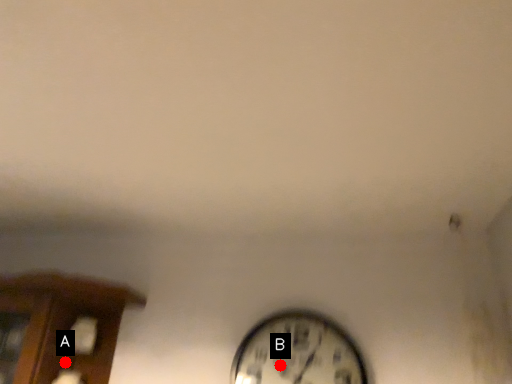
Question: Two points are circled on the image, labeled by A and B beside each circle. Which point appears closest to the camera in this image?

Choices:
 (A) A is closer
 (B) B is closer

Answer: (A)